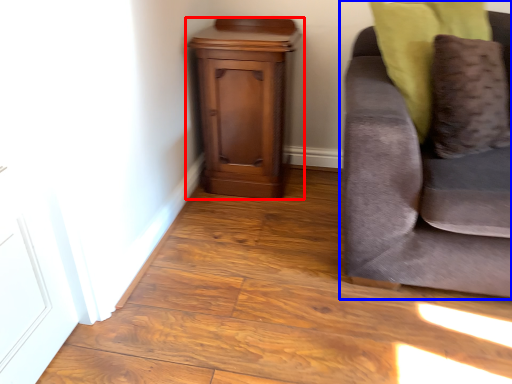
Question: Which point is further to the camera, nightstand (highlighted by a red box) or studio couch (highlighted by a blue box)?

Choices:
 (A) nightstand
 (B) studio couch

Answer: (A)